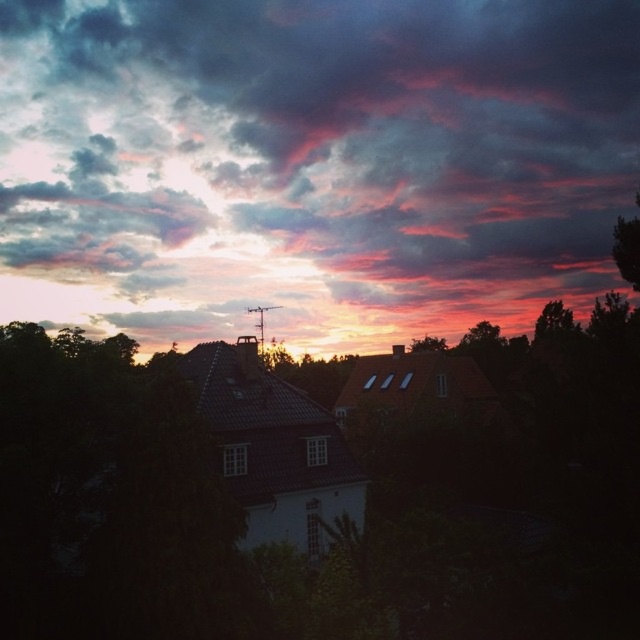
Does dark green leafy tree at upper right lie behind green leafy tree at center?

No, dark green leafy tree at upper right is closer to the viewer.

Who is more distant from viewer, (570,314) or (412,349)?

Point (412,349)

Identify the location of dark green leafy tree at upper right. (556, 324).

Based on the photo, is cloudy sky at upper center thinner than green leafy tree at right?

In fact, cloudy sky at upper center might be wider than green leafy tree at right.

Is cloudy sky at upper center shorter than green leafy tree at right?

In fact, cloudy sky at upper center may be taller than green leafy tree at right.

Find the location of a particular element. cloudy sky at upper center is located at coordinates (312, 164).

Who is positioned more to the left, cloudy sky at upper center or dark green leafy tree at upper right?

cloudy sky at upper center is more to the left.

Who is higher up, cloudy sky at upper center or dark green leafy tree at upper right?

Positioned higher is cloudy sky at upper center.

Locate an element on the screen. This screenshot has width=640, height=640. cloudy sky at upper center is located at coordinates (312, 164).

The image size is (640, 640). I want to click on cloudy sky at upper center, so click(312, 164).